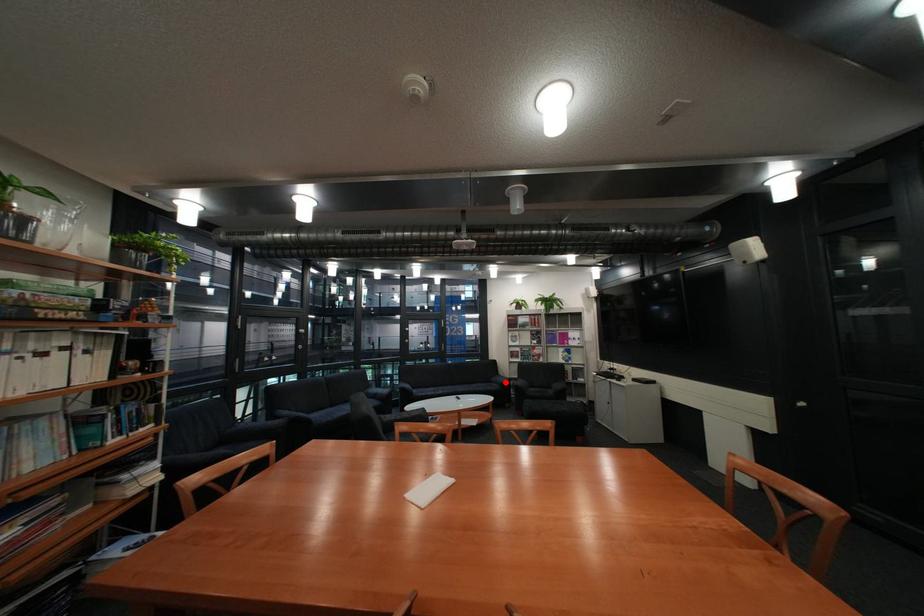
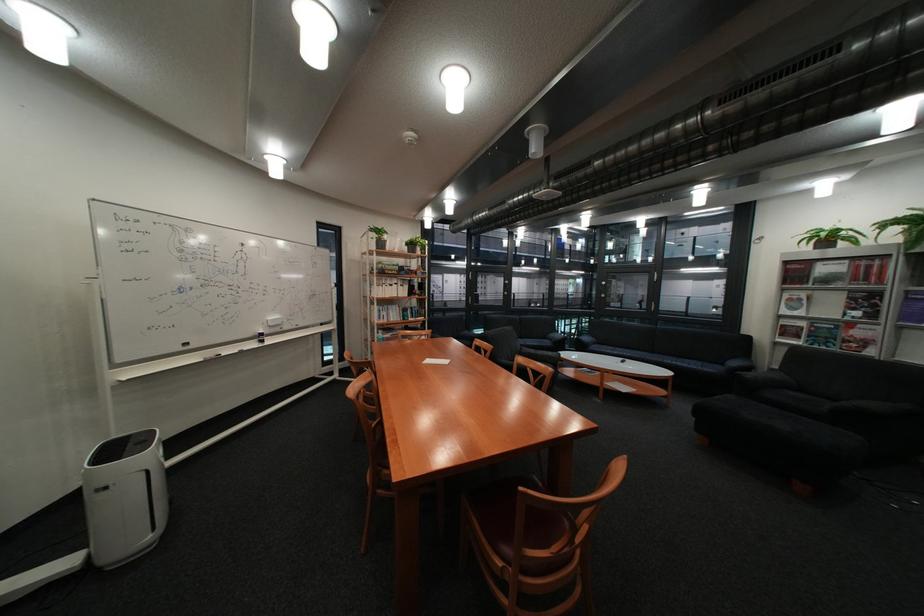
Locate, in the second image, the point that corresponds to the highlighted location in the first image.

(737, 363)